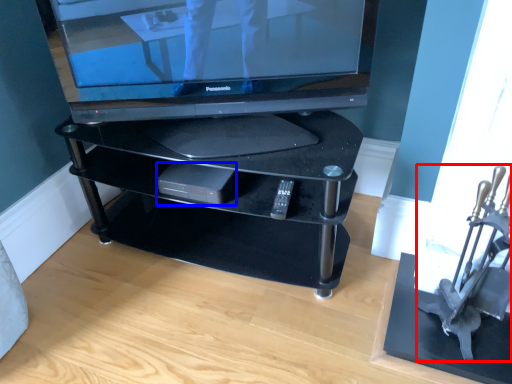
Question: Which of the following is the farthest to the observer, armchair (highlighted by a red box) or gadget (highlighted by a blue box)?

Choices:
 (A) armchair
 (B) gadget

Answer: (B)